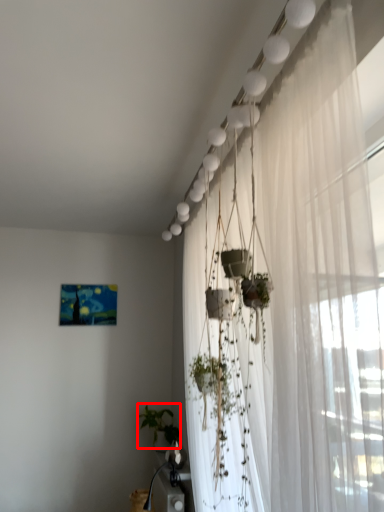
Question: From the image's perspective, where is plant (annotated by the red box) located in relation to curtain in the image?

Choices:
 (A) above
 (B) below

Answer: (B)